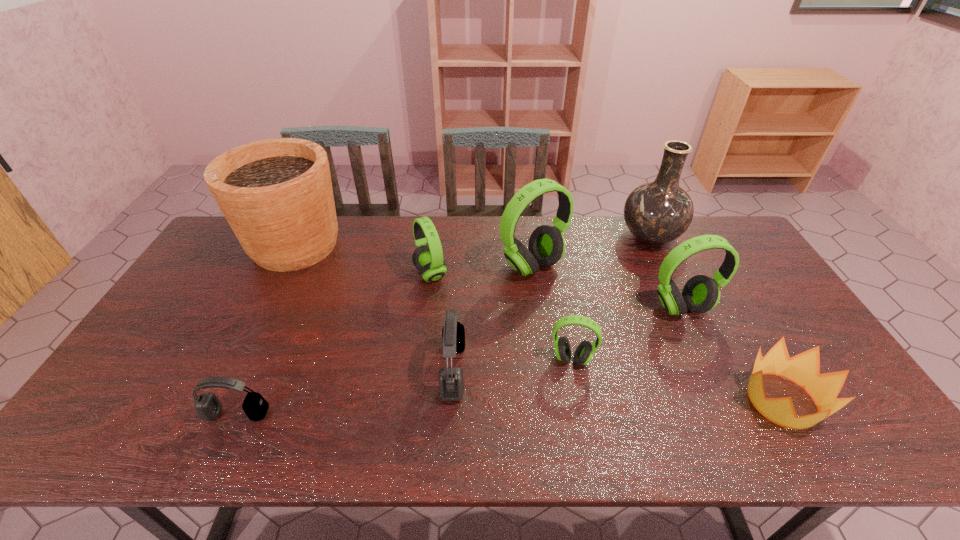
This screenshot has height=540, width=960. What are the coordinates of `free space between the second headset from left to right and the gold crown` in the screenshot? It's located at (607, 338).

Locate an element on the screen. empty location between the third farthest headset and the flowerpot is located at coordinates (489, 277).

Find the location of a particular element. This screenshot has width=960, height=540. blank region between the leftmost headset and the crown is located at coordinates (510, 407).

You are a GUI agent. You are given a task and a screenshot of the screen. Output one action in this format:
    pyautogui.click(x=<x>, y=<y>)
    Task: Click on the free spot between the flowerpot and the nearest green headset
    
    Given the screenshot: What is the action you would take?
    pyautogui.click(x=434, y=302)

I want to click on free space between the biggest green headset and the gold crown, so click(658, 333).

Where is `object that can be found as the third closest to the fifth headset from right to left`? This screenshot has height=540, width=960. object that can be found as the third closest to the fifth headset from right to left is located at coordinates (276, 194).

Identify which object is the eighth nearest to the crown. Please provide its 2D coordinates. Your answer should be formatted as a tuple, i.e. [(x, y)], where the tuple contains the x and y coordinates of a point satisfying the conditions above.

[(276, 194)]

Select which headset is the third closest to the tallest headset. Please provide its 2D coordinates. Your answer should be formatted as a tuple, i.e. [(x, y)], where the tuple contains the x and y coordinates of a point satisfying the conditions above.

[(451, 385)]

Find the location of a particular element. The height and width of the screenshot is (540, 960). headset that can be found as the fourth closest to the left black headset is located at coordinates point(546,247).

I want to click on green headset that is the closest one to the crown, so click(x=700, y=294).